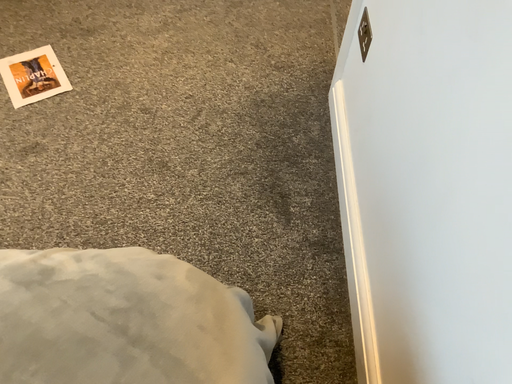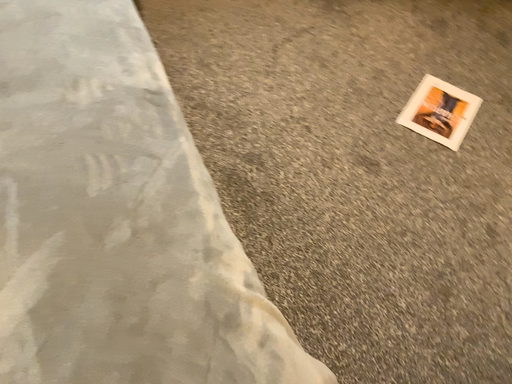
Question: How did the camera likely rotate when shooting the video?

Choices:
 (A) rotated right
 (B) rotated left

Answer: (B)